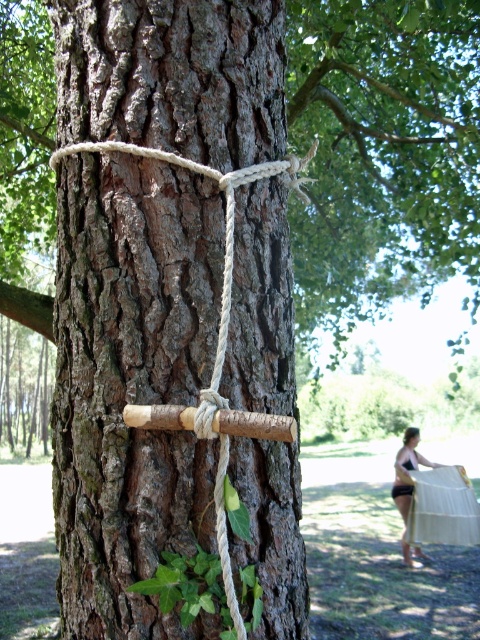
Between rough bark tree trunk at center and brown rough wood at center, which one is positioned higher?

brown rough wood at center is above.

From the picture: Is rough bark tree trunk at center behind brown rough wood at center?

No, rough bark tree trunk at center is closer to the viewer.

What do you see at coordinates (131, 385) in the screenshot? This screenshot has height=640, width=480. I see `rough bark tree trunk at center` at bounding box center [131, 385].

At what (x,y) coordinates should I click in order to perform the action: click on rough bark tree trunk at center. Please return your answer as a coordinate pair (x, y). The image size is (480, 640). Looking at the image, I should click on (131, 385).